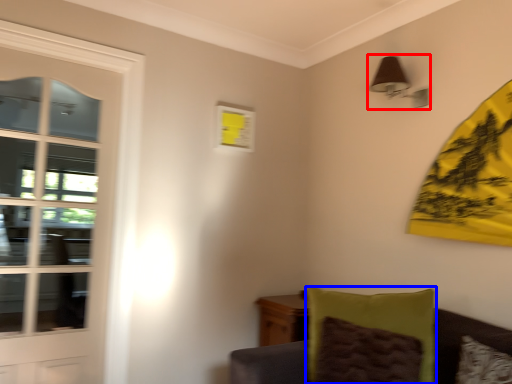
Question: Which object appears farthest to the camera in this image, light fixture (highlighted by a red box) or pillow (highlighted by a blue box)?

Choices:
 (A) light fixture
 (B) pillow

Answer: (A)